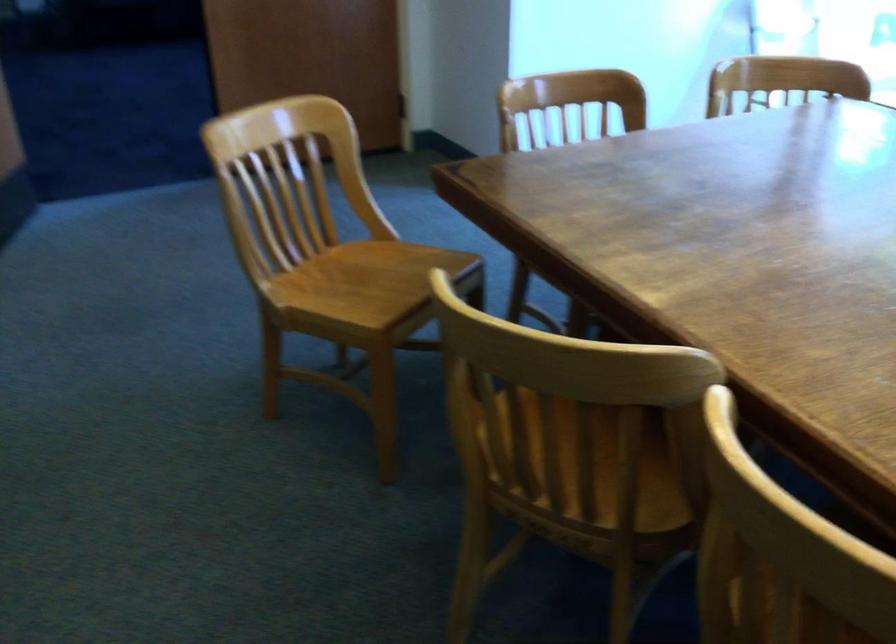
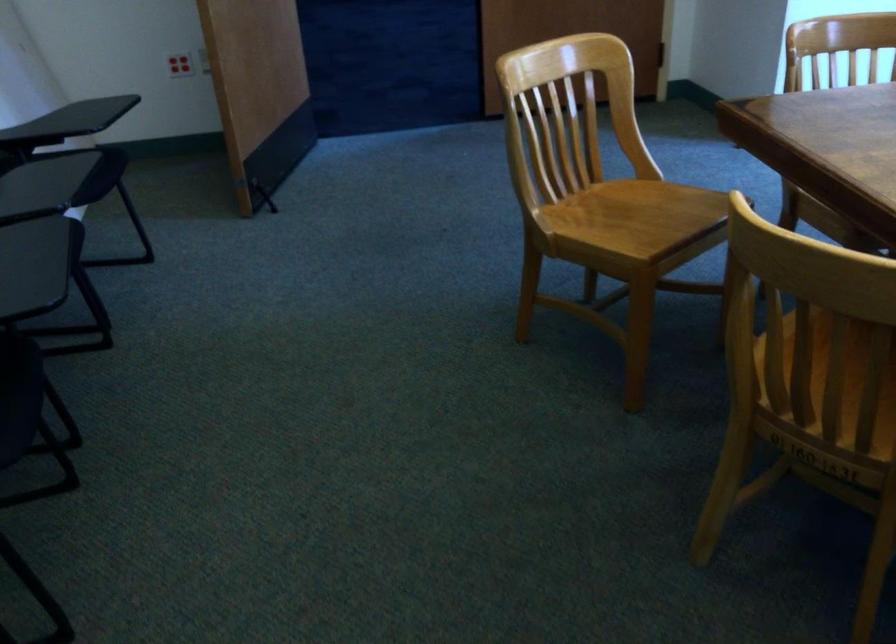
Locate, in the second image, the point that corresponds to (x=376, y=279) in the first image.

(640, 216)